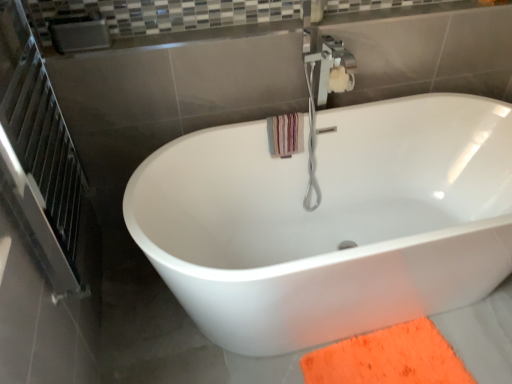
Question: Should I look upward or downward to see striped cotton beach towel at upper right?

Choices:
 (A) down
 (B) up

Answer: (B)

Question: Can you confirm if white glossy bathtub at center is smaller than striped cotton beach towel at upper right?

Choices:
 (A) yes
 (B) no

Answer: (B)

Question: Is striped cotton beach towel at upper right at the back of white glossy bathtub at center?

Choices:
 (A) yes
 (B) no

Answer: (A)

Question: Does white glossy bathtub at center have a lesser width compared to striped cotton beach towel at upper right?

Choices:
 (A) yes
 (B) no

Answer: (B)

Question: Is white glossy bathtub at center not close to striped cotton beach towel at upper right?

Choices:
 (A) yes
 (B) no

Answer: (B)

Question: Can you confirm if white glossy bathtub at center is shorter than striped cotton beach towel at upper right?

Choices:
 (A) yes
 (B) no

Answer: (B)

Question: Is white glossy bathtub at center taller than striped cotton beach towel at upper right?

Choices:
 (A) yes
 (B) no

Answer: (A)

Question: Does white glossy bathtub at center turn towards brushed metal balustrade at upper center?

Choices:
 (A) yes
 (B) no

Answer: (B)

Question: Can you confirm if white glossy bathtub at center is bigger than brushed metal balustrade at upper center?

Choices:
 (A) yes
 (B) no

Answer: (A)

Question: Does white glossy bathtub at center contain brushed metal balustrade at upper center?

Choices:
 (A) yes
 (B) no

Answer: (B)

Question: Does white glossy bathtub at center appear on the left side of brushed metal balustrade at upper center?

Choices:
 (A) yes
 (B) no

Answer: (B)

Question: Would you say white glossy bathtub at center is outside brushed metal balustrade at upper center?

Choices:
 (A) yes
 (B) no

Answer: (A)

Question: From the image's perspective, is white glossy bathtub at center located beneath brushed metal balustrade at upper center?

Choices:
 (A) no
 (B) yes

Answer: (B)

Question: Does brushed metal balustrade at upper center have a lesser height compared to metallic silver screen door at left?

Choices:
 (A) yes
 (B) no

Answer: (A)